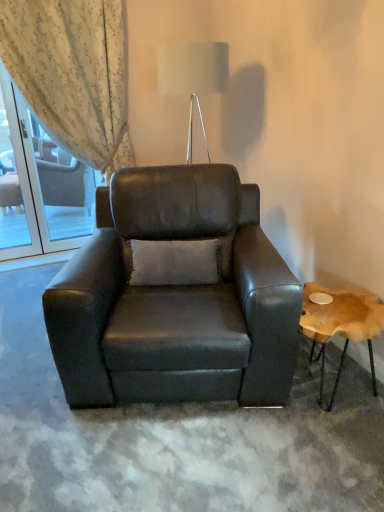
What is the approximate width of metallic silver table lamp at upper center?

It is 17.54 inches.

Based on the photo, in order to face metallic silver table lamp at upper center, should I rotate leftwards or rightwards?

Turn right by 0.131 degrees to look at metallic silver table lamp at upper center.

You are a GUI agent. You are given a task and a screenshot of the screen. Output one action in this format:
    pyautogui.click(x=<x>, y=<y>)
    Task: Click on the wooden natural stool at right
    Image resolution: width=384 pixels, height=512 pixels.
    Given the screenshot: What is the action you would take?
    pyautogui.click(x=341, y=323)

Image resolution: width=384 pixels, height=512 pixels. Find the location of `metallic silver table lamp at upper center`. metallic silver table lamp at upper center is located at coordinates (193, 70).

Is matte black armchair at center thinner than clear glass screen door at upper left?

Incorrect, the width of matte black armchair at center is not less than that of clear glass screen door at upper left.

From a real-world perspective, who is located lower, matte black armchair at center or clear glass screen door at upper left?

In real-world perspective, matte black armchair at center is lower.

Does matte black armchair at center come behind clear glass screen door at upper left?

No, matte black armchair at center is closer to the camera.

From the image's perspective, is matte black armchair at center above or below clear glass screen door at upper left?

From the image's perspective, matte black armchair at center appears below clear glass screen door at upper left.

Between point (12, 88) and point (37, 72), which one is positioned behind?

The point (12, 88) is farther from the camera.

Between clear glass screen door at upper left and light beige textured curtain at upper left, which one has larger size?

light beige textured curtain at upper left is bigger.

How distant is clear glass screen door at upper left from light beige textured curtain at upper left?

clear glass screen door at upper left is 80.99 centimeters from light beige textured curtain at upper left.

Is clear glass screen door at upper left in front of or behind light beige textured curtain at upper left in the image?

In the image, clear glass screen door at upper left appears behind light beige textured curtain at upper left.

Consider the image. Which object is wider, metallic silver table lamp at upper center or matte black armchair at center?

Wider between the two is matte black armchair at center.

Is the position of metallic silver table lamp at upper center less distant than that of matte black armchair at center?

No, it is behind matte black armchair at center.

Is metallic silver table lamp at upper center directly adjacent to matte black armchair at center?

metallic silver table lamp at upper center and matte black armchair at center are clearly separated.

In the image, is wooden natural stool at right on the left side or the right side of matte black armchair at center?

Clearly, wooden natural stool at right is on the right of matte black armchair at center in the image.

How different are the orientations of wooden natural stool at right and matte black armchair at center in degrees?

They differ by 11.6 degrees in their facing directions.

From the image's perspective, which one is positioned higher, wooden natural stool at right or matte black armchair at center?

matte black armchair at center appears higher in the image.

The image size is (384, 512). I want to click on chair above the wooden natural stool at right (from a real-world perspective), so point(175,298).

Is point (216, 208) positioned before point (377, 327)?

No, it is not.

Considering the sizes of objects matte black armchair at center and wooden natural stool at right in the image provided, who is smaller, matte black armchair at center or wooden natural stool at right?

With smaller size is wooden natural stool at right.

From the image's perspective, between light beige textured curtain at upper left and wooden natural stool at right, which one is located above?

light beige textured curtain at upper left appears higher in the image.

Is the position of light beige textured curtain at upper left more distant than that of wooden natural stool at right?

Yes, light beige textured curtain at upper left is behind wooden natural stool at right.

Considering the positions of point (121, 0) and point (369, 326), is point (121, 0) closer or farther from the camera than point (369, 326)?

Point (121, 0) is farther from the camera than point (369, 326).

From a real-world perspective, between light beige textured curtain at upper left and wooden natural stool at right, who is vertically lower?

In real-world perspective, wooden natural stool at right is lower.

Does light beige textured curtain at upper left come in front of metallic silver table lamp at upper center?

No, light beige textured curtain at upper left is further to the viewer.

Is light beige textured curtain at upper left oriented away from metallic silver table lamp at upper center?

light beige textured curtain at upper left does not have its back to metallic silver table lamp at upper center.

Is light beige textured curtain at upper left wider than metallic silver table lamp at upper center?

In fact, light beige textured curtain at upper left might be narrower than metallic silver table lamp at upper center.

Which of these two, light beige textured curtain at upper left or metallic silver table lamp at upper center, is bigger?

light beige textured curtain at upper left.

What are the coordinates of `chair below the clear glass screen door at upper left (from a real-world perspective)` in the screenshot? It's located at (175, 298).

This screenshot has height=512, width=384. I want to click on screen door on the left of light beige textured curtain at upper left, so click(14, 183).

When comparing their distances from wooden natural stool at right, does light beige textured curtain at upper left or matte black armchair at center seem further?

Based on the image, light beige textured curtain at upper left appears to be further to wooden natural stool at right.

Looking at the image, which one is located closer to light beige textured curtain at upper left, clear glass screen door at upper left or wooden natural stool at right?

The object closer to light beige textured curtain at upper left is clear glass screen door at upper left.

Looking at the image, which one is located further to wooden natural stool at right, clear glass screen door at upper left or light beige textured curtain at upper left?

Based on the image, clear glass screen door at upper left appears to be further to wooden natural stool at right.

Which object lies nearer to the anchor point metallic silver table lamp at upper center, clear glass screen door at upper left or wooden natural stool at right?

wooden natural stool at right is closer to metallic silver table lamp at upper center.

Which object lies further to the anchor point wooden natural stool at right, clear glass screen door at upper left or metallic silver table lamp at upper center?

Based on the image, clear glass screen door at upper left appears to be further to wooden natural stool at right.

From the image, which object appears to be farther from metallic silver table lamp at upper center, light beige textured curtain at upper left or wooden natural stool at right?

The object further to metallic silver table lamp at upper center is wooden natural stool at right.

Considering their positions, is matte black armchair at center positioned closer to clear glass screen door at upper left than metallic silver table lamp at upper center?

matte black armchair at center is closer to clear glass screen door at upper left.

Based on their spatial positions, is clear glass screen door at upper left or light beige textured curtain at upper left closer to matte black armchair at center?

Among the two, light beige textured curtain at upper left is located nearer to matte black armchair at center.

This screenshot has width=384, height=512. Find the location of `chair between metallic silver table lamp at upper center and wooden natural stool at right in the up-down direction`. chair between metallic silver table lamp at upper center and wooden natural stool at right in the up-down direction is located at coordinates (175, 298).

The width and height of the screenshot is (384, 512). Identify the location of curtain positioned between matte black armchair at center and clear glass screen door at upper left from near to far. (73, 73).

This screenshot has width=384, height=512. Find the location of `curtain between clear glass screen door at upper left and metallic silver table lamp at upper center from left to right`. curtain between clear glass screen door at upper left and metallic silver table lamp at upper center from left to right is located at coordinates (73, 73).

Identify the location of table lamp between light beige textured curtain at upper left and wooden natural stool at right from left to right. coord(193,70).